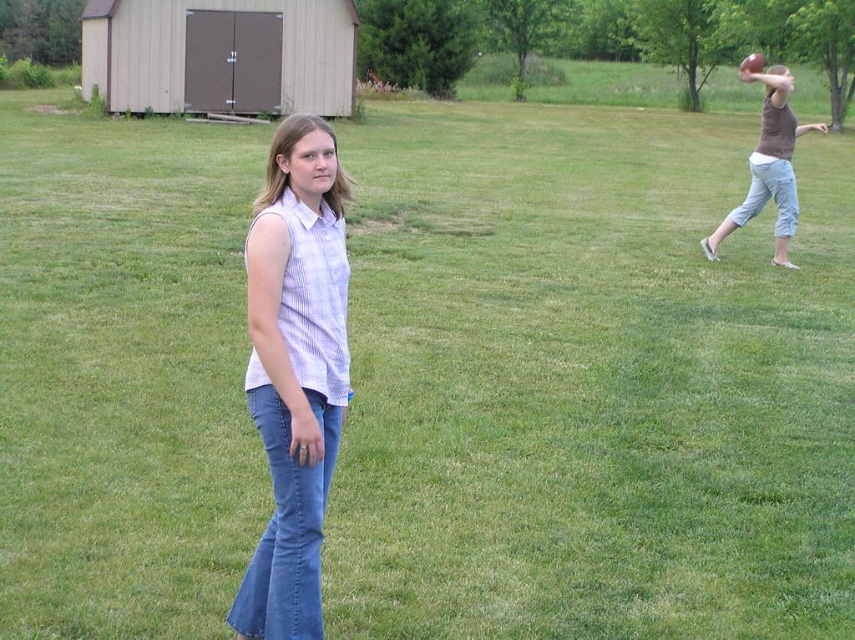
The height and width of the screenshot is (640, 855). What do you see at coordinates (293, 371) in the screenshot?
I see `denim jeans at center` at bounding box center [293, 371].

Is denim jeans at center shorter than brown cotton shirt at upper right?

Yes.

I want to click on denim jeans at center, so click(293, 371).

Locate an element on the screen. This screenshot has height=640, width=855. denim jeans at center is located at coordinates (293, 371).